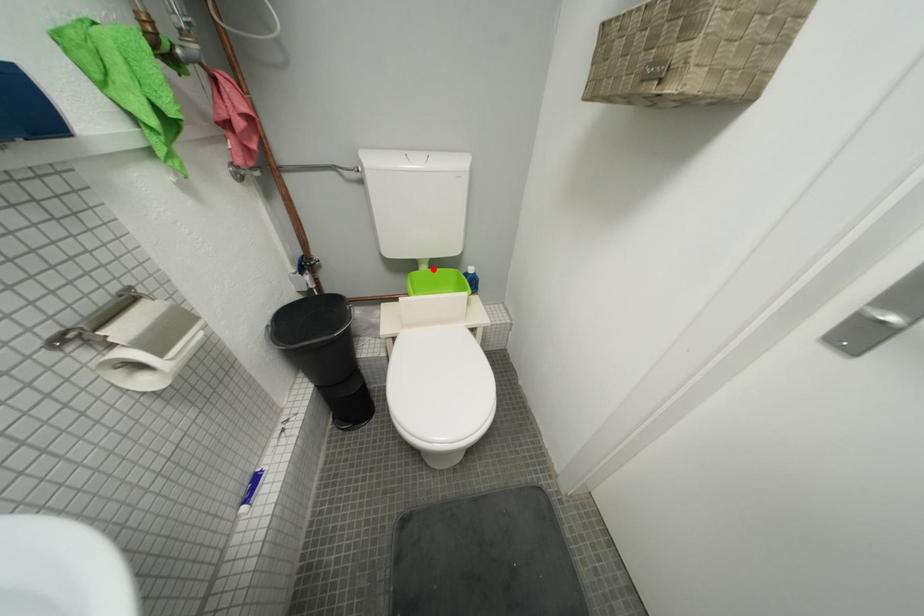
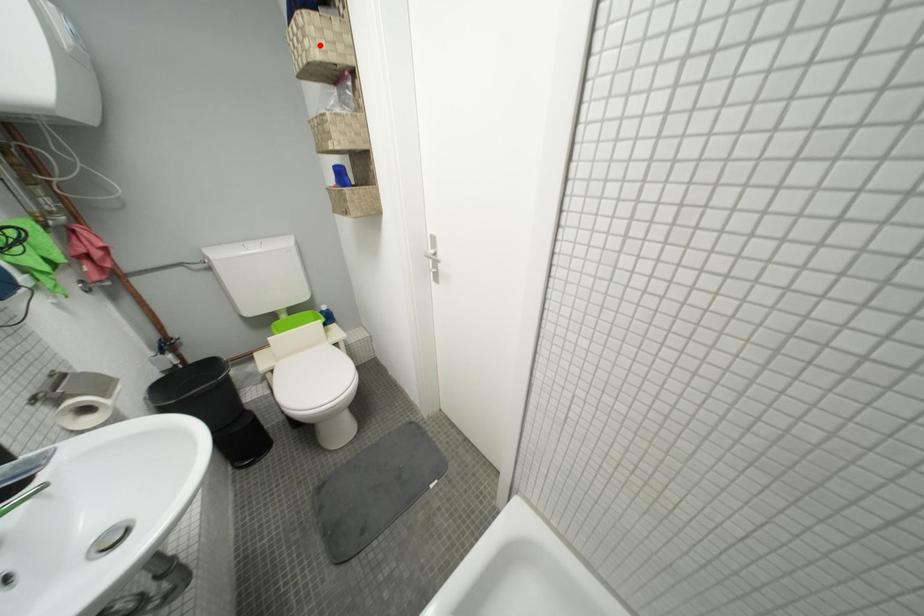
I am providing you with two images of the same scene from different viewpoints. A red point is marked on the first image and another point is marked on the second image. Do the highlighted points in image1 and image2 indicate the same real-world spot?

No